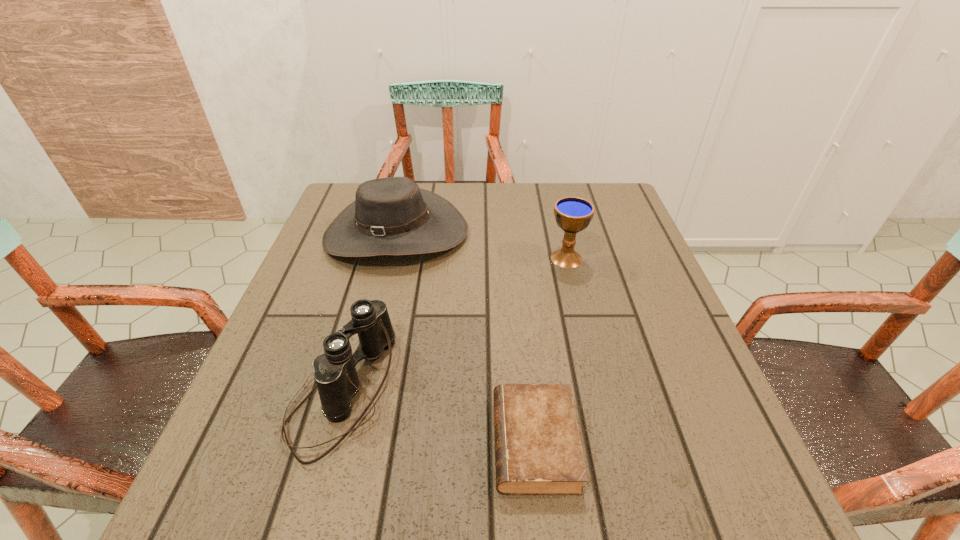
In order to click on blank space at the far left corner of the desktop in this screenshot , I will do `click(346, 206)`.

In the image, there is a desktop. Identify the location of vacant space at the far right corner. The height and width of the screenshot is (540, 960). (x=633, y=222).

This screenshot has width=960, height=540. Find the location of `free area in between the rightmost object and the cowboy hat`. free area in between the rightmost object and the cowboy hat is located at coordinates (481, 246).

The height and width of the screenshot is (540, 960). Find the location of `free spot between the rightmost object and the diary`. free spot between the rightmost object and the diary is located at coordinates (550, 350).

The image size is (960, 540). What are the coordinates of `vacant space that is in between the diary and the binoculars` in the screenshot? It's located at (439, 417).

Identify the location of vacant area that lies between the rightmost object and the diary. (550, 350).

This screenshot has width=960, height=540. I want to click on unoccupied area between the binoculars and the second object from right to left, so tap(439, 417).

The width and height of the screenshot is (960, 540). Find the location of `free spot between the chalice and the cowboy hat`. free spot between the chalice and the cowboy hat is located at coordinates (481, 246).

Locate an element on the screen. This screenshot has height=540, width=960. blank region between the cowboy hat and the diary is located at coordinates (466, 338).

Find the location of a particular element. The width and height of the screenshot is (960, 540). unoccupied area between the binoculars and the rightmost object is located at coordinates (454, 325).